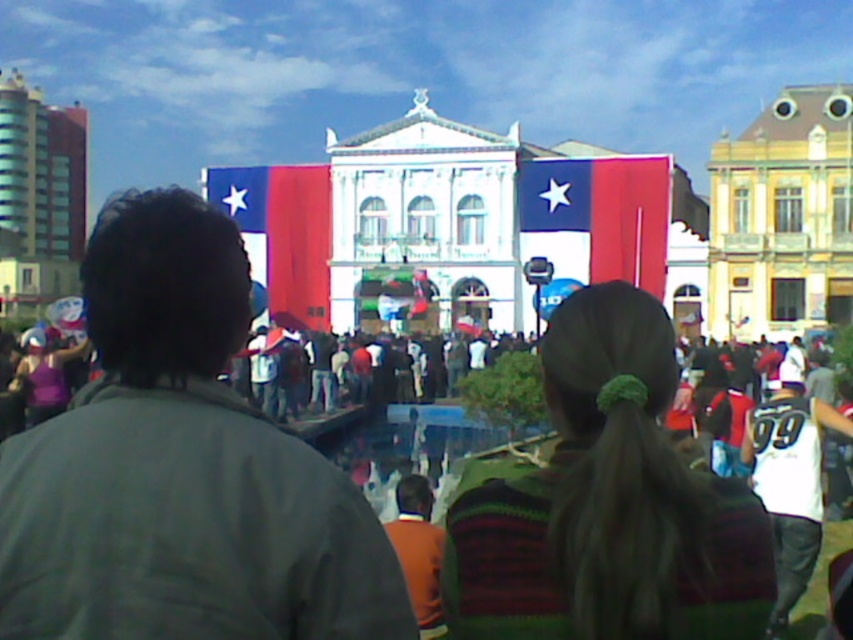
Is green knitted sweater at center thinner than matte fabric flag at center?

No.

Image resolution: width=853 pixels, height=640 pixels. What do you see at coordinates (608, 504) in the screenshot?
I see `green knitted sweater at center` at bounding box center [608, 504].

Locate an element on the screen. Image resolution: width=853 pixels, height=640 pixels. green knitted sweater at center is located at coordinates (608, 504).

Does dark green jacket at center appear on the left side of matte red flag at center?

Correct, you'll find dark green jacket at center to the left of matte red flag at center.

Is dark green jacket at center bigger than matte red flag at center?

Yes.

Is point (276, 525) behind point (659, 278)?

No, (276, 525) is in front of (659, 278).

You are a GUI agent. You are given a task and a screenshot of the screen. Output one action in this format:
    pyautogui.click(x=<x>, y=<y>)
    Task: Click on the dark green jacket at center
    
    Given the screenshot: What is the action you would take?
    pyautogui.click(x=181, y=468)

Is dark green jacket at center wider than matte fabric flag at center?

Yes.

Is point (289, 632) positioned after point (282, 308)?

No, (289, 632) is closer to viewer.

Where is `dark green jacket at center`? This screenshot has width=853, height=640. dark green jacket at center is located at coordinates (181, 468).